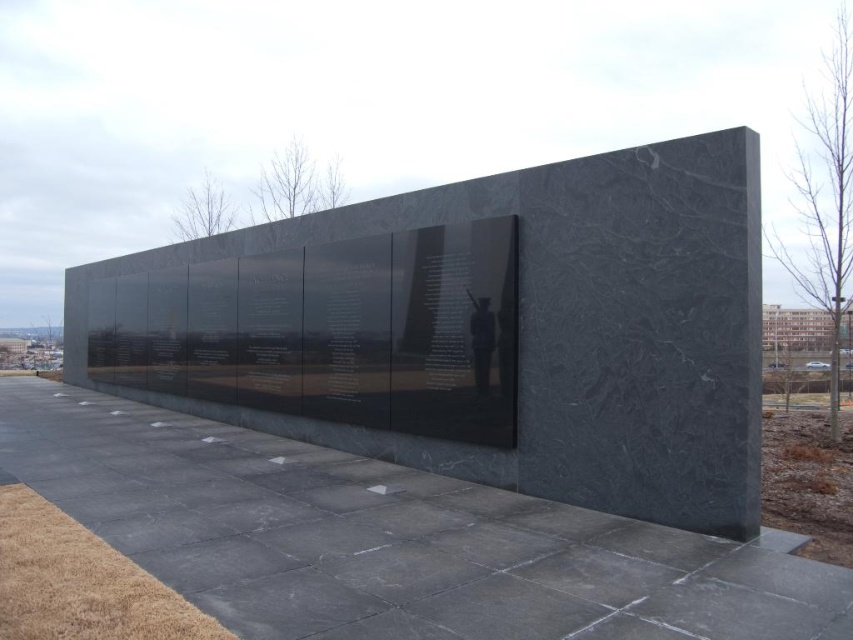
You are standing in front of the memorial wall and want to take a photo of the matte black statue at center without the black polished stone wall at center appearing in the frame. Is this possible based on their positions?

The black polished stone wall at center is positioned over the matte black statue at center, so it would block the view of the statue entirely. Therefore, it is not possible to take a photo of the matte black statue at center without the black polished stone wall at center appearing in the frame.

You are standing at the point closest to the memorial wall. Which of the two points, point (189,332) or point (587,595), is farther away from you?

Point (189,332) is behind point (587,595), so it is farther away from you.

You are standing in front of the memorial and want to place a wreath exactly between the black polished stone wall at center and the black polished concrete at center. Which object should you move towards if you are currently facing the wall?

Since the black polished stone wall at center is to the left of the black polished concrete at center, you should move towards the black polished concrete at center to place the wreath between them.